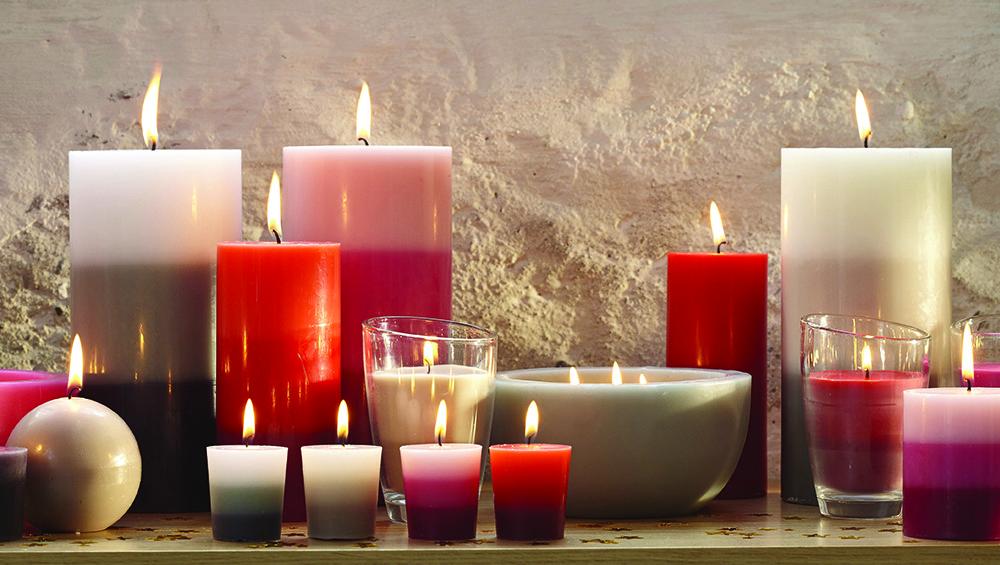
This screenshot has height=565, width=1000. I want to click on pillar candle, so click(x=911, y=258), click(x=727, y=306), click(x=370, y=238), click(x=180, y=267), click(x=259, y=307), click(x=27, y=391), click(x=955, y=427).